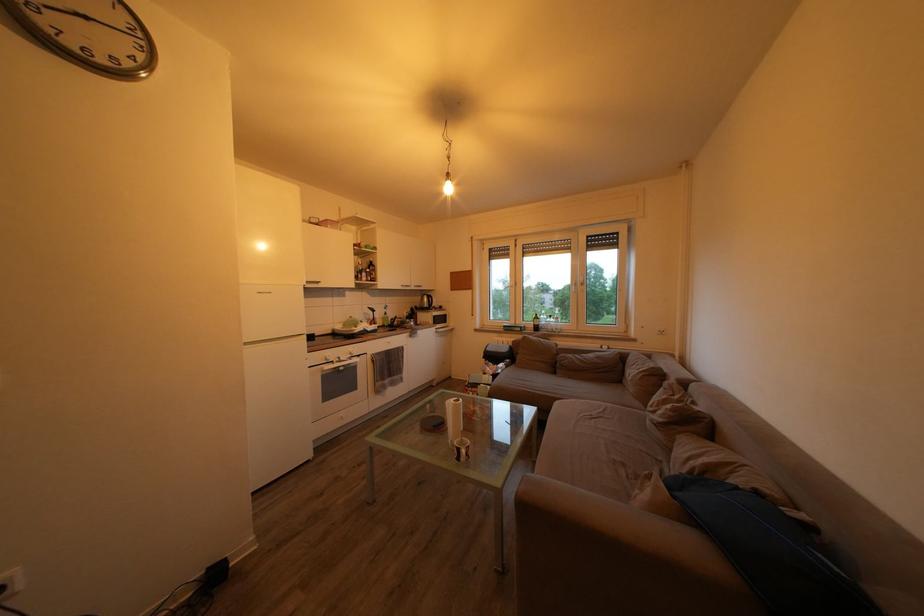
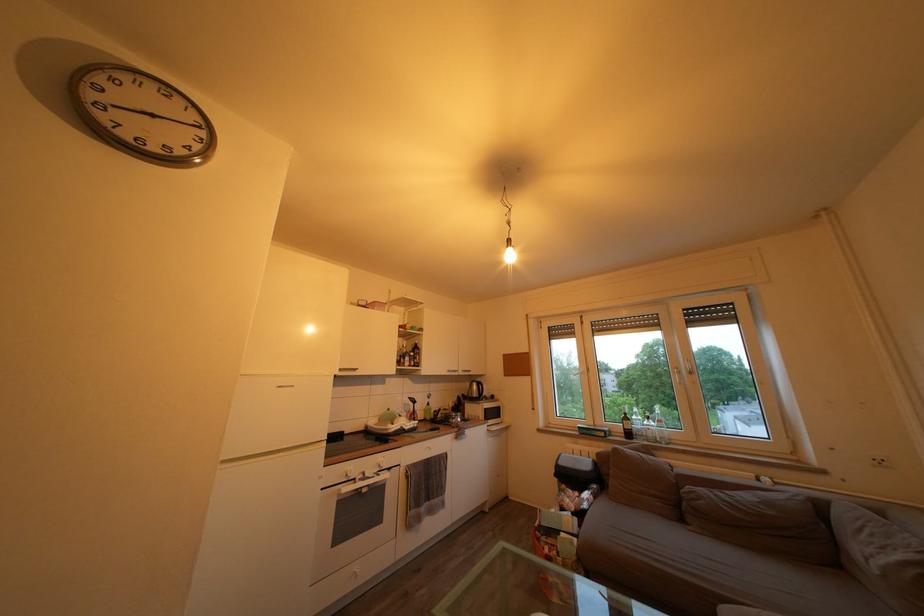
Where in the second image is the point corresponding to point (433, 306) from the first image?

(482, 392)